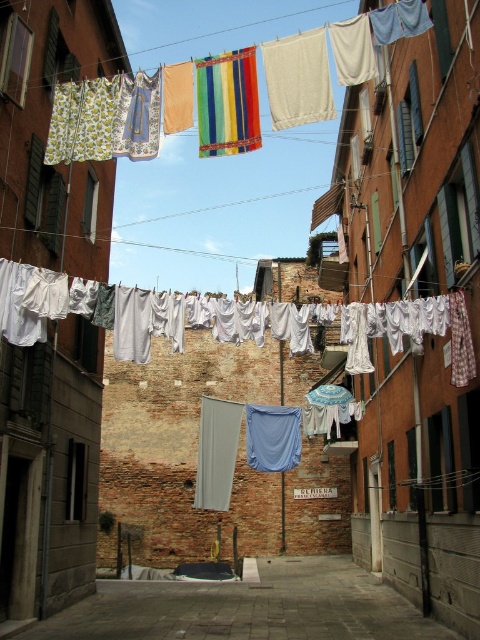
Question: Does smooth concrete pavement at center come behind multicolored fabric at upper center?

Choices:
 (A) no
 (B) yes

Answer: (B)

Question: Based on their relative distances, which object is farther from the white fabric at center?

Choices:
 (A) smooth concrete pavement at center
 (B) multicolored fabric at upper center

Answer: (A)

Question: Among these objects, which one is farthest from the camera?

Choices:
 (A) smooth concrete pavement at center
 (B) white fabric at center
 (C) multicolored fabric at upper center

Answer: (A)

Question: Considering the relative positions of smooth concrete pavement at center and multicolored fabric at upper center in the image provided, where is smooth concrete pavement at center located with respect to multicolored fabric at upper center?

Choices:
 (A) above
 (B) below

Answer: (B)

Question: Based on their relative distances, which object is farther from the multicolored fabric at upper center?

Choices:
 (A) white fabric at center
 (B) smooth concrete pavement at center

Answer: (B)

Question: Is multicolored fabric at upper center further to camera compared to white fabric at center?

Choices:
 (A) yes
 (B) no

Answer: (A)